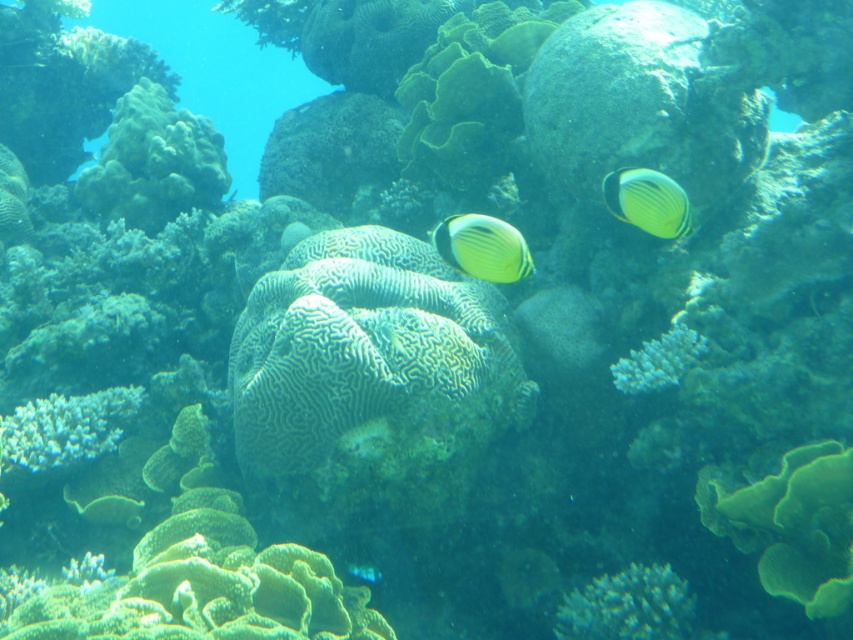
Looking at this image, you are a marine biologist observing an underwater scene. You notice the white coral at lower center and the yellow matte butterflyfish at center. How far apart are these two marine organisms?

The white coral at lower center is 27.90 inches from the yellow matte butterflyfish at center.

You are a diver exploring the underwater coral reef. You notice two points marked in the scene. Which point is closer to you, point (643,218) or point (676,369)?

Point (643,218) is closer to the viewer than point (676,369).